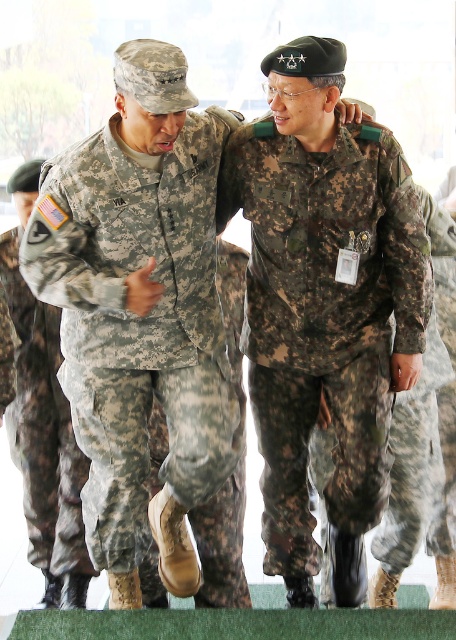
You are a photographer standing at a certain distance from the camouflage uniform at center. If you want to take a closeup shot of it, would you need to move closer or farther away?

The camouflage uniform at center is 11.39 feet from camera, so to take a closeup shot, you would need to move closer to reduce the distance.

You are a military analyst observing the scene. You notice a point marked at coordinates (139, 310). Based on the scene description, can you determine which uniform this point is located on?

The point at coordinates (139, 310) is located on the camouflage uniform at center.